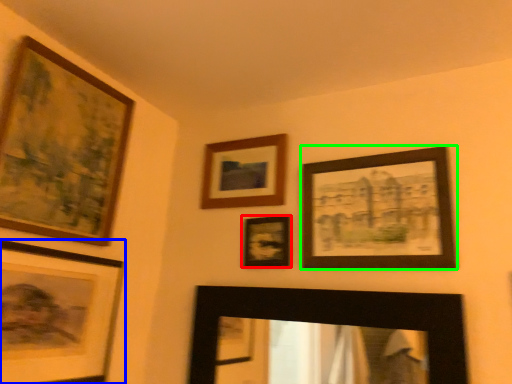
Question: Which object is positioned closest to picture frame (highlighted by a red box)? Select from picture frame (highlighted by a blue box) and picture frame (highlighted by a green box).

Choices:
 (A) picture frame
 (B) picture frame

Answer: (B)